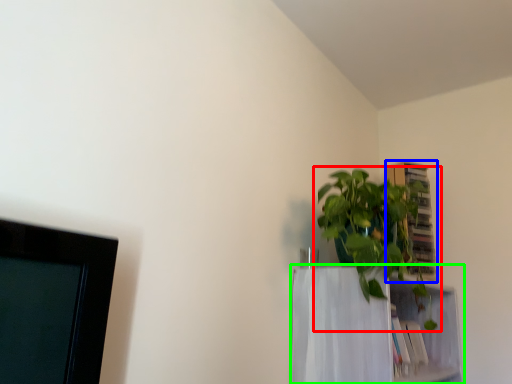
Question: Considering the real-world distances, which object is farthest from houseplant (highlighted by a red box)? cabinet (highlighted by a blue box) or shelf (highlighted by a green box)?

Choices:
 (A) cabinet
 (B) shelf

Answer: (A)